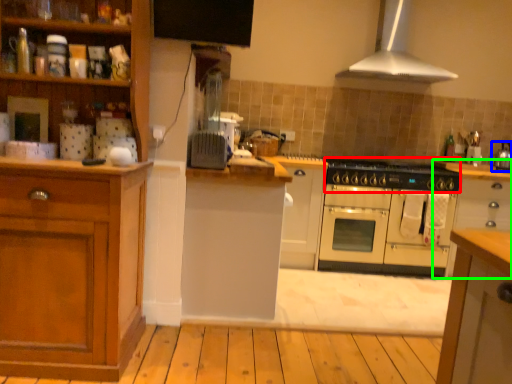
Question: Which object is the farthest from gas stove (highlighted by a red box)? Choose among these: kitchen appliance (highlighted by a blue box) or cabinetry (highlighted by a green box).

Choices:
 (A) kitchen appliance
 (B) cabinetry

Answer: (A)